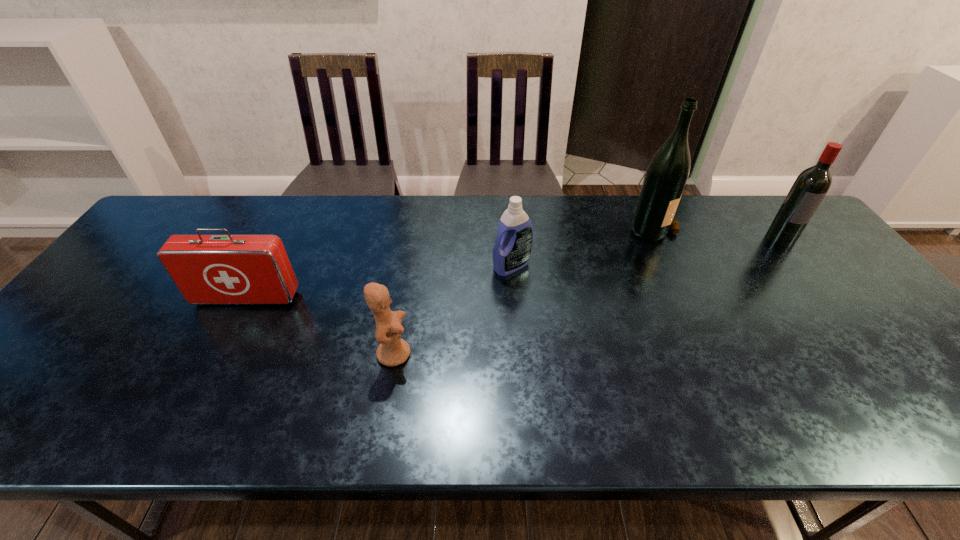
In the image, there is a desktop. Identify the location of vacant space at the far left corner. This screenshot has height=540, width=960. (216, 197).

You are a GUI agent. You are given a task and a screenshot of the screen. Output one action in this format:
    pyautogui.click(x=<x>, y=<y>)
    Task: Click on the vacant point located between the third nearest object and the taller wine bottle
    This screenshot has height=540, width=960.
    Given the screenshot: What is the action you would take?
    pyautogui.click(x=582, y=246)

The width and height of the screenshot is (960, 540). I want to click on empty space that is in between the shorter wine bottle and the second object from right to left, so click(716, 233).

Image resolution: width=960 pixels, height=540 pixels. I want to click on vacant area that lies between the tallest object and the third nearest object, so click(582, 246).

At what (x,y) coordinates should I click in order to perform the action: click on free space that is in between the detergent and the nearest object. Please return your answer as a coordinate pair (x, y). The height and width of the screenshot is (540, 960). Looking at the image, I should click on (453, 309).

At what (x,y) coordinates should I click in order to perform the action: click on empty space that is in between the tallest object and the third farthest object. Please return your answer as a coordinate pair (x, y). This screenshot has height=540, width=960. Looking at the image, I should click on point(582,246).

Where is `free point between the nearest object and the second nearest object`? This screenshot has width=960, height=540. free point between the nearest object and the second nearest object is located at coordinates (321, 326).

This screenshot has width=960, height=540. What are the coordinates of `empty space between the tallest object and the figurine` in the screenshot? It's located at (523, 290).

Find the location of `free space that is in between the fourth farthest object and the figurine`. free space that is in between the fourth farthest object and the figurine is located at coordinates (321, 326).

Find the location of a particular element. This screenshot has height=540, width=960. vacant space in between the tallest object and the third object from left to right is located at coordinates (582, 246).